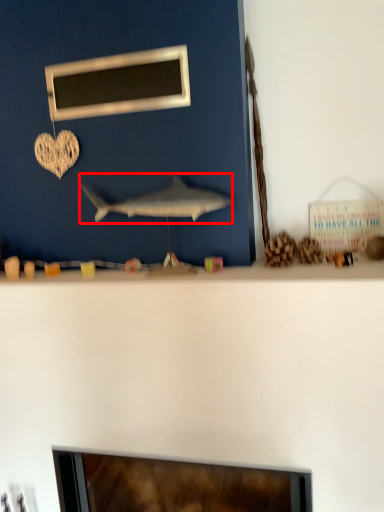
Question: Observing the image, what is the correct spatial positioning of fish (annotated by the red box) in reference to picture frame?

Choices:
 (A) left
 (B) right

Answer: (B)